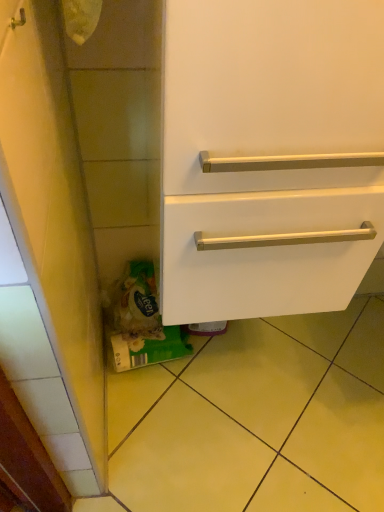
What do you see at coordinates (257, 418) in the screenshot? I see `yellow tile at lower left` at bounding box center [257, 418].

This screenshot has height=512, width=384. I want to click on yellow tile at lower left, so click(257, 418).

Locate an element on the screen. This screenshot has height=512, width=384. white matte drawer at center is located at coordinates (270, 156).

Describe the element at coordinates (270, 156) in the screenshot. I see `white matte drawer at center` at that location.

At what (x,y) coordinates should I click in order to perform the action: click on yellow tile at lower left. Please return your answer as a coordinate pair (x, y). Looking at the image, I should click on (257, 418).

Which object is positioned more to the right, white matte drawer at center or yellow tile at lower left?

yellow tile at lower left.

Between white matte drawer at center and yellow tile at lower left, which one is positioned behind?

yellow tile at lower left is further away from the camera.

Which is behind, point (223, 236) or point (196, 432)?

The point (196, 432) is farther.

From the image's perspective, who appears lower, white matte drawer at center or yellow tile at lower left?

yellow tile at lower left, from the image's perspective.

From a real-world perspective, is white matte drawer at center under yellow tile at lower left?

No, from a real-world perspective, white matte drawer at center is not beneath yellow tile at lower left.

Considering the sizes of objects white matte drawer at center and yellow tile at lower left in the image provided, who is wider, white matte drawer at center or yellow tile at lower left?

yellow tile at lower left is wider.

Between white matte drawer at center and yellow tile at lower left, which one has less height?

yellow tile at lower left.

Who is smaller, white matte drawer at center or yellow tile at lower left?

Smaller between the two is yellow tile at lower left.

Do you think white matte drawer at center is within yellow tile at lower left, or outside of it?

white matte drawer at center is outside yellow tile at lower left.

Would you say white matte drawer at center is a long distance from yellow tile at lower left?

No, white matte drawer at center is in close proximity to yellow tile at lower left.

Is white matte drawer at center turned away from yellow tile at lower left?

white matte drawer at center is not turned away from yellow tile at lower left.

Based on the photo, how many degrees apart are the facing directions of white matte drawer at center and yellow tile at lower left?

The angle between the facing direction of white matte drawer at center and the facing direction of yellow tile at lower left is 89.6 degrees.

At what (x,y) coordinates should I click in order to perform the action: click on tile below the white matte drawer at center (from a real-world perspective). Please return your answer as a coordinate pair (x, y). The image size is (384, 512). Looking at the image, I should click on (257, 418).

Considering the positions of objects yellow tile at lower left and white matte drawer at center in the image provided, who is more to the left, yellow tile at lower left or white matte drawer at center?

white matte drawer at center is more to the left.

Which is behind, yellow tile at lower left or white matte drawer at center?

yellow tile at lower left.

Considering the points (379, 472) and (264, 163), which point is behind, point (379, 472) or point (264, 163)?

The point (379, 472) is farther.

From the image's perspective, is yellow tile at lower left above or below white matte drawer at center?

yellow tile at lower left is situated lower than white matte drawer at center in the image.

From a real-world perspective, is yellow tile at lower left below white matte drawer at center?

Yes, from a real-world perspective, yellow tile at lower left is beneath white matte drawer at center.

Between yellow tile at lower left and white matte drawer at center, which one has smaller width?

With smaller width is white matte drawer at center.

Which of these two, yellow tile at lower left or white matte drawer at center, stands shorter?

yellow tile at lower left.

Who is smaller, yellow tile at lower left or white matte drawer at center?

yellow tile at lower left is smaller.

Is yellow tile at lower left not inside white matte drawer at center?

Yes.

Based on the photo, are yellow tile at lower left and white matte drawer at center making contact?

No, yellow tile at lower left is not making contact with white matte drawer at center.

Is yellow tile at lower left turned away from white matte drawer at center?

That's not correct — yellow tile at lower left is not looking away from white matte drawer at center.

The width and height of the screenshot is (384, 512). Find the location of `tile below the white matte drawer at center (from a real-world perspective)`. tile below the white matte drawer at center (from a real-world perspective) is located at coordinates (257, 418).

Where is `tile behind the white matte drawer at center`? tile behind the white matte drawer at center is located at coordinates (257, 418).

The width and height of the screenshot is (384, 512). Find the location of `drawer in front of the yellow tile at lower left`. drawer in front of the yellow tile at lower left is located at coordinates (270, 156).